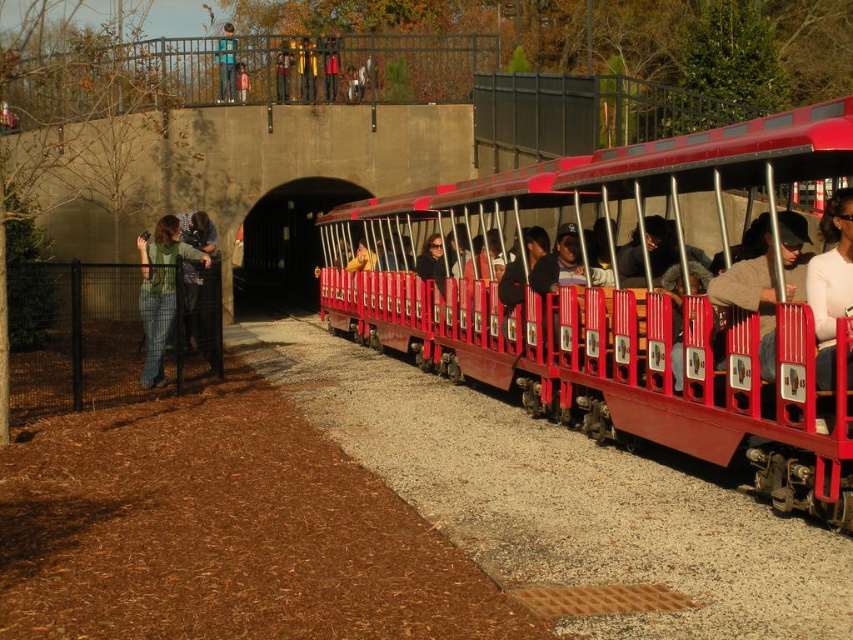
Question: Does metallic red train at right appear under green sweater at left?

Choices:
 (A) yes
 (B) no

Answer: (B)

Question: Does metallic red train at right appear on the right side of green sweater at left?

Choices:
 (A) no
 (B) yes

Answer: (B)

Question: Among these points, which one is nearest to the camera?

Choices:
 (A) (171, 276)
 (B) (746, 307)

Answer: (B)

Question: Can you confirm if metallic red train at right is positioned above green sweater at left?

Choices:
 (A) yes
 (B) no

Answer: (A)

Question: Which point is farther to the camera?

Choices:
 (A) (465, 298)
 (B) (177, 252)

Answer: (A)